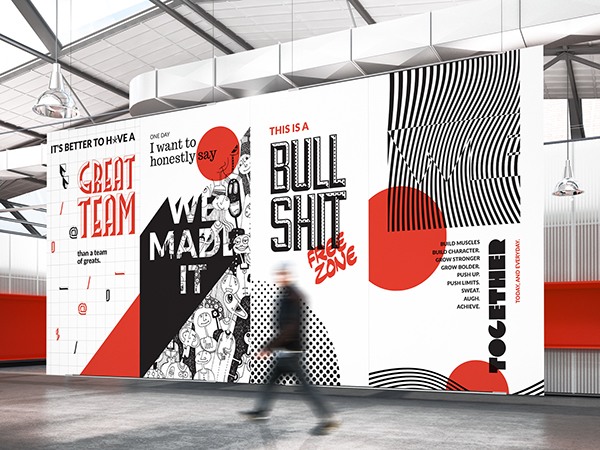
Find the location of a particular element. The height and width of the screenshot is (450, 600). hanging lights is located at coordinates (63, 109), (560, 189).